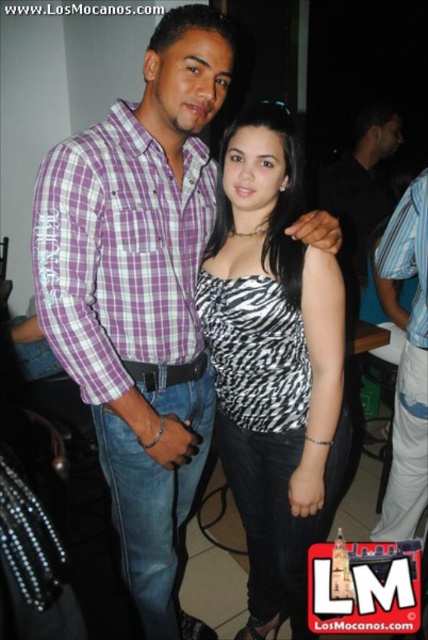
The image size is (428, 640). Describe the element at coordinates (140, 296) in the screenshot. I see `purple checkered shirt at center` at that location.

Who is lower down, purple checkered shirt at center or zebra print top at center?

zebra print top at center is below.

Describe the element at coordinates (140, 296) in the screenshot. This screenshot has height=640, width=428. I see `purple checkered shirt at center` at that location.

You are a GUI agent. You are given a task and a screenshot of the screen. Output one action in this format:
    pyautogui.click(x=<x>, y=<y>)
    Task: Click on the purple checkered shirt at center
    The width and height of the screenshot is (428, 640).
    Given the screenshot: What is the action you would take?
    pyautogui.click(x=140, y=296)

The height and width of the screenshot is (640, 428). What do you see at coordinates (140, 296) in the screenshot?
I see `purple checkered shirt at center` at bounding box center [140, 296].

This screenshot has width=428, height=640. Describe the element at coordinates (140, 296) in the screenshot. I see `purple checkered shirt at center` at that location.

Where is `purple checkered shirt at center`? purple checkered shirt at center is located at coordinates (140, 296).

Measure the distance from zebra print top at center to striped shirt at right.

The distance of zebra print top at center from striped shirt at right is 23.64 inches.

Does point (255, 298) lie behind point (407, 381)?

No, (255, 298) is in front of (407, 381).

You are a GUI agent. You are given a task and a screenshot of the screen. Output one action in this format:
    pyautogui.click(x=<x>, y=<y>)
    Task: Click on the zebra print top at center
    This screenshot has width=428, height=640.
    Given the screenshot: What is the action you would take?
    pyautogui.click(x=273, y=365)